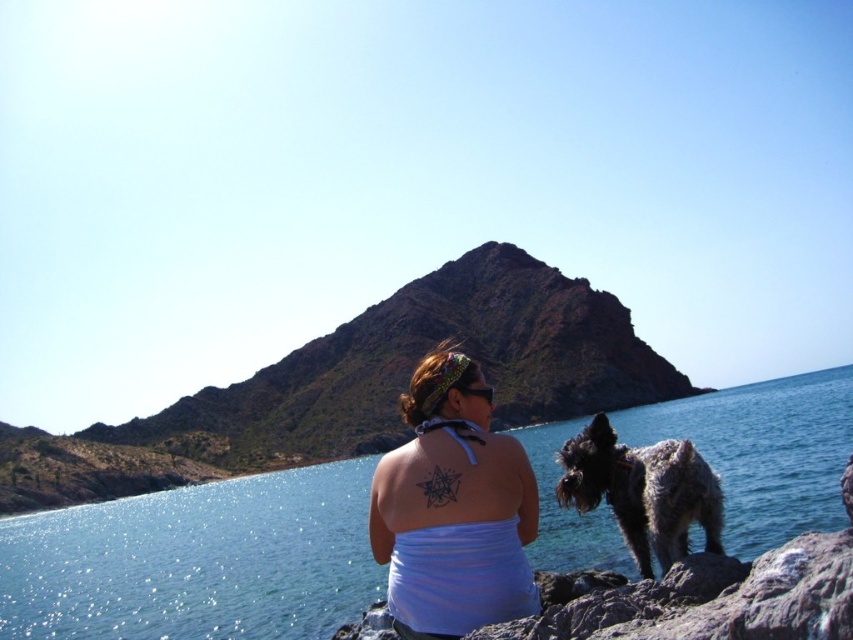
You are standing at the same spot as the woman in the scene. Which direction should you look to see both the blue liquid water at center and the spotted fur dog at lower right in your field of view?

You should look to your right because the blue liquid water at center is to the right of the spotted fur dog at lower right.

You are a photographer trying to capture the woman and the dog in the scene. Since you want to ensure both the white matte tank top at center and the spotted fur dog at lower right are visible in the frame, which object should you position closer to the edge of the photo?

The spotted fur dog at lower right should be positioned closer to the edge of the photo because the white matte tank top at center is to the left of the spotted fur dog at lower right, so moving the dog towards the edge would keep both in frame.